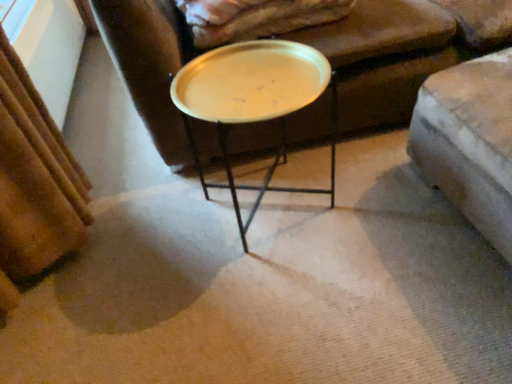
Question: From the image's perspective, would you say metallic gold tray at center is positioned over velvet beige blanket at upper center?

Choices:
 (A) no
 (B) yes

Answer: (A)

Question: Is metallic gold tray at center outside of velvet beige blanket at upper center?

Choices:
 (A) yes
 (B) no

Answer: (A)

Question: Is metallic gold tray at center further to the viewer compared to velvet beige blanket at upper center?

Choices:
 (A) yes
 (B) no

Answer: (B)

Question: Does metallic gold tray at center have a larger size compared to velvet beige blanket at upper center?

Choices:
 (A) yes
 (B) no

Answer: (A)

Question: Does metallic gold tray at center appear on the right side of velvet beige blanket at upper center?

Choices:
 (A) yes
 (B) no

Answer: (B)

Question: From a real-world perspective, is metallic gold tray at center over velvet beige blanket at upper center?

Choices:
 (A) yes
 (B) no

Answer: (B)

Question: Can you confirm if velvet beige blanket at upper center is bigger than metallic gold tray at center?

Choices:
 (A) yes
 (B) no

Answer: (B)

Question: Is velvet beige blanket at upper center behind metallic gold tray at center?

Choices:
 (A) yes
 (B) no

Answer: (A)

Question: Is velvet beige blanket at upper center oriented away from metallic gold tray at center?

Choices:
 (A) no
 (B) yes

Answer: (A)

Question: From a real-world perspective, is velvet beige blanket at upper center under metallic gold tray at center?

Choices:
 (A) yes
 (B) no

Answer: (B)

Question: Can you confirm if velvet beige blanket at upper center is thinner than metallic gold tray at center?

Choices:
 (A) no
 (B) yes

Answer: (A)

Question: Are velvet beige blanket at upper center and metallic gold tray at center far apart?

Choices:
 (A) yes
 (B) no

Answer: (B)

Question: From a real-world perspective, relative to velvet beige blanket at upper center, is metallic gold tray at center vertically above or below?

Choices:
 (A) below
 (B) above

Answer: (A)